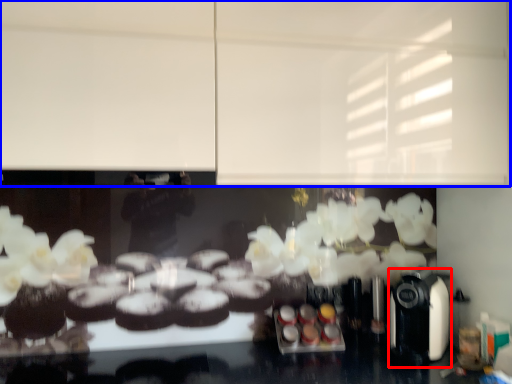
Question: Which object is further to the camera taking this photo, coffee machine (highlighted by a red box) or backdrop (highlighted by a blue box)?

Choices:
 (A) coffee machine
 (B) backdrop

Answer: (A)